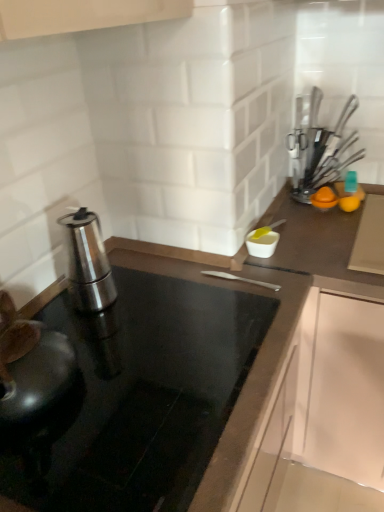
Question: From a real-world perspective, is polished stainless steel espresso maker at left, the second kitchen appliance viewed from the right, physically located above or below black glass countertop at center?

Choices:
 (A) above
 (B) below

Answer: (A)

Question: From the image's perspective, relative to black glass countertop at center, is polished stainless steel espresso maker at left, the second kitchen appliance viewed from the right, above or below?

Choices:
 (A) below
 (B) above

Answer: (B)

Question: Which is nearer to the polished stainless steel espresso maker at left, the second kitchen appliance viewed from the right?

Choices:
 (A) metallic silver utensils at upper right, the first kitchen appliance viewed from the right
 (B) black glass countertop at center

Answer: (B)

Question: Which object is the farthest from the black glass countertop at center?

Choices:
 (A) metallic silver utensils at upper right, arranged as the 2th kitchen appliance when viewed from the left
 (B) polished stainless steel espresso maker at left, arranged as the second kitchen appliance when viewed from the top

Answer: (A)